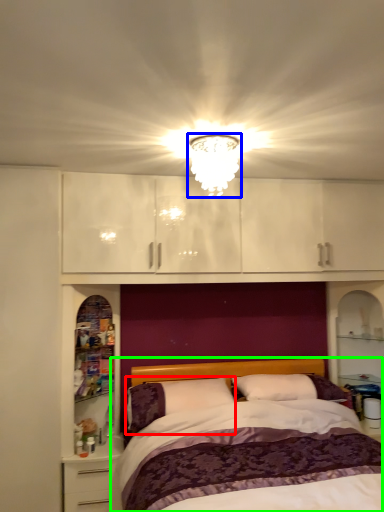
Question: Which object is positioned closest to pillow (highlighted by a red box)? Select from light fixture (highlighted by a blue box) and bed (highlighted by a green box).

Choices:
 (A) light fixture
 (B) bed

Answer: (B)